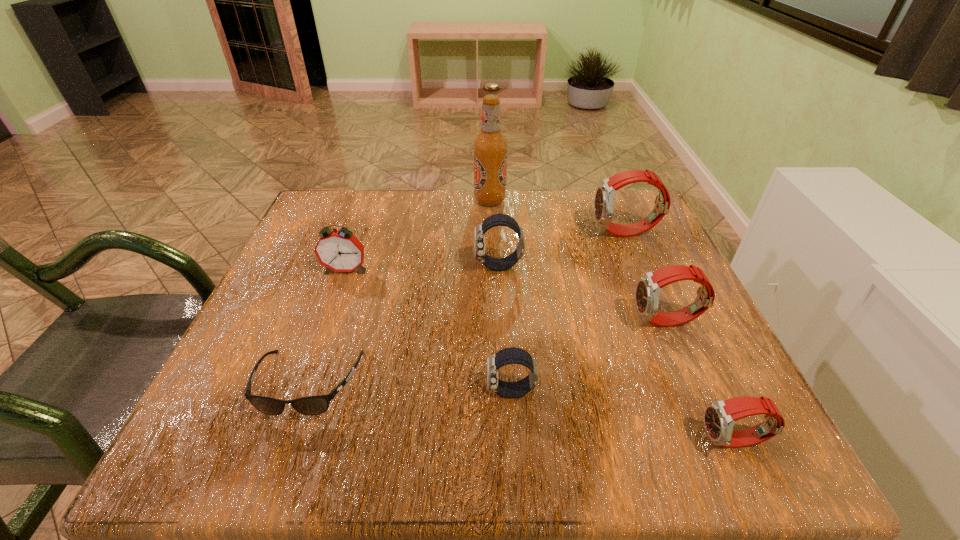
Choose which watch is the nearest neighbor to the farthest watch. Please provide its 2D coordinates. Your answer should be formatted as a tuple, i.e. [(x, y)], where the tuple contains the x and y coordinates of a point satisfying the conditions above.

[(501, 264)]

You are a GUI agent. You are given a task and a screenshot of the screen. Output one action in this format:
    pyautogui.click(x=<x>, y=<y>)
    Task: Click on the fourth closest watch to the nearer dark watch
    The image size is (960, 540).
    Given the screenshot: What is the action you would take?
    pyautogui.click(x=605, y=194)

Find the location of a particular element. the second closest red watch to the second farthest watch is located at coordinates click(x=648, y=288).

Select which red watch is the second closest to the farthest object. Please provide its 2D coordinates. Your answer should be formatted as a tuple, i.e. [(x, y)], where the tuple contains the x and y coordinates of a point satisfying the conditions above.

[(648, 288)]

Identify the location of vacant position in the image that satisfies the following two spatial constraints: 1. on the front label of the tallest object; 2. on the front-facing side of the gray sunglasses. This screenshot has width=960, height=540. (495, 384).

Locate an element on the screen. The image size is (960, 540). vacant space that satisfies the following two spatial constraints: 1. on the face of the seventh shortest object; 2. on the front-facing side of the sunglasses is located at coordinates (691, 384).